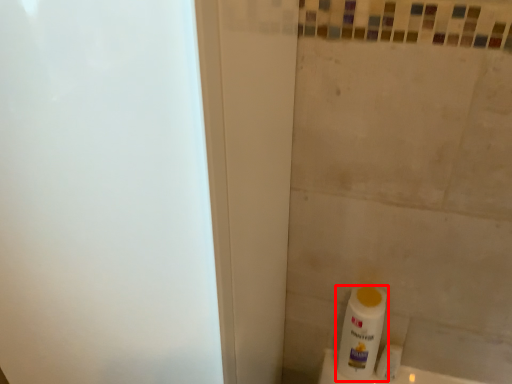
Question: From the image, what is the correct spatial relationship of bottle (annotated by the red box) in relation to toilet paper?

Choices:
 (A) left
 (B) right

Answer: (A)